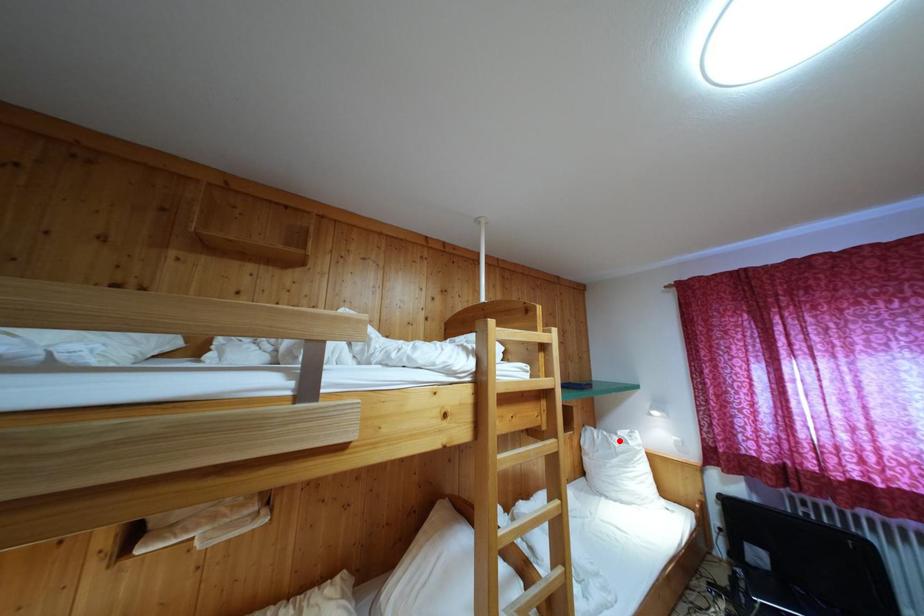
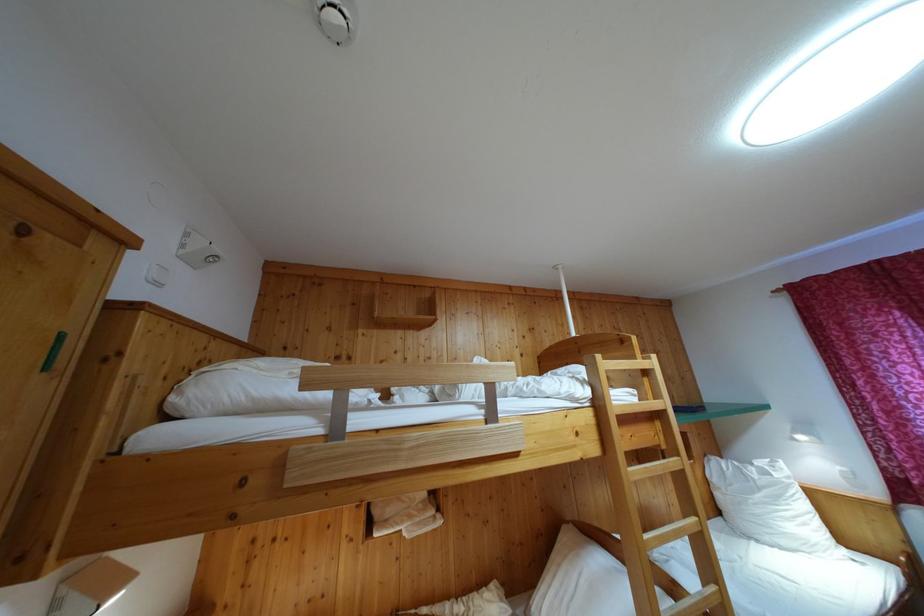
Question: I am providing you with two images of the same scene from different viewpoints. Image1 has a red point marked. In image2, the corresponding 3D location appears at what relative position? Reply with the corresponding letter.

Choices:
 (A) Closer
 (B) Farther

Answer: (A)